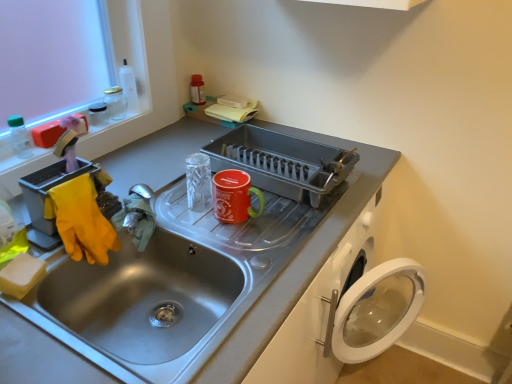
Describe the element at coordinates (19, 137) in the screenshot. I see `transparent plastic bottle at upper left` at that location.

How much space does glossy ceramic mug at upper center, arranged as the 2th appliance when viewed from the left, occupy vertically?

The height of glossy ceramic mug at upper center, arranged as the 2th appliance when viewed from the left, is 4.82 inches.

This screenshot has height=384, width=512. Describe the element at coordinates (282, 162) in the screenshot. I see `metallic gray dish rack at center, which is the first appliance in right-to-left order` at that location.

Find the location of `stainless steel sink at center`. stainless steel sink at center is located at coordinates (194, 288).

Locate an element on the screen. The width and height of the screenshot is (512, 384). transparent plastic bottle at upper left is located at coordinates (19, 137).

From a real-world perspective, is stainless steel sink at center located higher than clear glass jar at upper left, placed as the first appliance when sorted from left to right?

No, from a real-world perspective, stainless steel sink at center is not above clear glass jar at upper left, placed as the first appliance when sorted from left to right.

Which of these two, stainless steel sink at center or clear glass jar at upper left, which is the third appliance from right to left, stands taller?

With more height is stainless steel sink at center.

From the picture: From the image's perspective, is stainless steel sink at center beneath clear glass jar at upper left, which is the third appliance from right to left?

Correct, stainless steel sink at center appears lower than clear glass jar at upper left, which is the third appliance from right to left, in the image.

In the scene shown: Considering the relative positions of stainless steel sink at center and clear glass jar at upper left, placed as the first appliance when sorted from left to right, in the image provided, is stainless steel sink at center to the left of clear glass jar at upper left, placed as the first appliance when sorted from left to right, from the viewer's perspective?

No.

In the scene shown: Are metallic gray dish rack at center, which is the first appliance in right-to-left order, and transparent plastic bottle at upper left located far from each other?

Actually, metallic gray dish rack at center, which is the first appliance in right-to-left order, and transparent plastic bottle at upper left are a little close together.

Based on the photo, does metallic gray dish rack at center, which is the first appliance in right-to-left order, appear on the right side of transparent plastic bottle at upper left?

Yes, metallic gray dish rack at center, which is the first appliance in right-to-left order, is to the right of transparent plastic bottle at upper left.

From a real-world perspective, is metallic gray dish rack at center, the third appliance from the left, beneath transparent plastic bottle at upper left?

Yes, from a real-world perspective, metallic gray dish rack at center, the third appliance from the left, is below transparent plastic bottle at upper left.

Looking at this image, how far apart are metallic gray dish rack at center, which is the first appliance in right-to-left order, and transparent plastic bottle at upper left?

A distance of 29.68 inches exists between metallic gray dish rack at center, which is the first appliance in right-to-left order, and transparent plastic bottle at upper left.

Is metallic gray dish rack at center, the third appliance from the left, closer to the viewer compared to glossy ceramic mug at upper center, arranged as the 2th appliance when viewed from the left?

No, metallic gray dish rack at center, the third appliance from the left, is behind glossy ceramic mug at upper center, arranged as the 2th appliance when viewed from the left.

How distant is metallic gray dish rack at center, which is the first appliance in right-to-left order, from glossy ceramic mug at upper center, the second appliance in the right-to-left sequence?

metallic gray dish rack at center, which is the first appliance in right-to-left order, and glossy ceramic mug at upper center, the second appliance in the right-to-left sequence, are 21.50 centimeters apart from each other.

Is metallic gray dish rack at center, which is the first appliance in right-to-left order, thinner than glossy ceramic mug at upper center, the second appliance in the right-to-left sequence?

In fact, metallic gray dish rack at center, which is the first appliance in right-to-left order, might be wider than glossy ceramic mug at upper center, the second appliance in the right-to-left sequence.

Are metallic gray dish rack at center, which is the first appliance in right-to-left order, and glossy ceramic mug at upper center, arranged as the 2th appliance when viewed from the left, far apart?

That's not correct — metallic gray dish rack at center, which is the first appliance in right-to-left order, is a little close to glossy ceramic mug at upper center, arranged as the 2th appliance when viewed from the left.

Is glossy ceramic mug at upper center, arranged as the 2th appliance when viewed from the left, bigger or smaller than transparent plastic bottle at upper left?

Clearly, glossy ceramic mug at upper center, arranged as the 2th appliance when viewed from the left, is larger in size than transparent plastic bottle at upper left.

Is glossy ceramic mug at upper center, the second appliance in the right-to-left sequence, taller than transparent plastic bottle at upper left?

Incorrect, the height of glossy ceramic mug at upper center, the second appliance in the right-to-left sequence, is not larger of that of transparent plastic bottle at upper left.

Considering the positions of objects glossy ceramic mug at upper center, the second appliance in the right-to-left sequence, and transparent plastic bottle at upper left in the image provided, who is more to the left, glossy ceramic mug at upper center, the second appliance in the right-to-left sequence, or transparent plastic bottle at upper left?

From the viewer's perspective, transparent plastic bottle at upper left appears more on the left side.

From a real-world perspective, is glossy ceramic mug at upper center, the second appliance in the right-to-left sequence, over transparent plastic bottle at upper left?

No, from a real-world perspective, glossy ceramic mug at upper center, the second appliance in the right-to-left sequence, is not on top of transparent plastic bottle at upper left.

What's the angular difference between clear glass jar at upper left, placed as the first appliance when sorted from left to right, and metallic gray dish rack at center, which is the first appliance in right-to-left order,'s facing directions?

They differ by 3.95 degrees in their facing directions.

Is point (93, 112) positioned in front of point (310, 151)?

No, (93, 112) is behind (310, 151).

Consider the image. How distant is clear glass jar at upper left, placed as the first appliance when sorted from left to right, from metallic gray dish rack at center, which is the first appliance in right-to-left order?

A distance of 25.23 inches exists between clear glass jar at upper left, placed as the first appliance when sorted from left to right, and metallic gray dish rack at center, which is the first appliance in right-to-left order.

Considering the relative sizes of clear glass jar at upper left, which is the third appliance from right to left, and metallic gray dish rack at center, the third appliance from the left, in the image provided, is clear glass jar at upper left, which is the third appliance from right to left, taller than metallic gray dish rack at center, the third appliance from the left,?

No, clear glass jar at upper left, which is the third appliance from right to left, is not taller than metallic gray dish rack at center, the third appliance from the left.

Which of these two, clear glass jar at upper left, placed as the first appliance when sorted from left to right, or glossy ceramic mug at upper center, the second appliance in the right-to-left sequence, is bigger?

glossy ceramic mug at upper center, the second appliance in the right-to-left sequence.

From the image's perspective, is clear glass jar at upper left, which is the third appliance from right to left, positioned above or below glossy ceramic mug at upper center, arranged as the 2th appliance when viewed from the left?

clear glass jar at upper left, which is the third appliance from right to left, is situated higher than glossy ceramic mug at upper center, arranged as the 2th appliance when viewed from the left, in the image.

Could you tell me if clear glass jar at upper left, which is the third appliance from right to left, is turned towards glossy ceramic mug at upper center, the second appliance in the right-to-left sequence?

Yes, clear glass jar at upper left, which is the third appliance from right to left, faces towards glossy ceramic mug at upper center, the second appliance in the right-to-left sequence.

From a real-world perspective, count 2nd appliances upward from the glossy ceramic mug at upper center, the second appliance in the right-to-left sequence, and point to it. Please provide its 2D coordinates.

[(98, 114)]

How far apart are transparent plastic bottle at upper left and glossy ceramic mug at upper center, the second appliance in the right-to-left sequence?

transparent plastic bottle at upper left and glossy ceramic mug at upper center, the second appliance in the right-to-left sequence, are 25.54 inches apart.

How many degrees apart are the facing directions of transparent plastic bottle at upper left and glossy ceramic mug at upper center, the second appliance in the right-to-left sequence?

transparent plastic bottle at upper left and glossy ceramic mug at upper center, the second appliance in the right-to-left sequence, are facing 1.63 degrees away from each other.

Does transparent plastic bottle at upper left come in front of glossy ceramic mug at upper center, the second appliance in the right-to-left sequence?

No, transparent plastic bottle at upper left is behind glossy ceramic mug at upper center, the second appliance in the right-to-left sequence.

Does transparent plastic bottle at upper left have a greater width compared to glossy ceramic mug at upper center, the second appliance in the right-to-left sequence?

No, transparent plastic bottle at upper left is not wider than glossy ceramic mug at upper center, the second appliance in the right-to-left sequence.

Locate an element on the screen. the 3rd appliance above the stainless steel sink at center (from a real-world perspective) is located at coordinates (98, 114).

Where is `bottle on the left of metallic gray dish rack at center, which is the first appliance in right-to-left order`? bottle on the left of metallic gray dish rack at center, which is the first appliance in right-to-left order is located at coordinates (19, 137).

From the picture: Based on their spatial positions, is stainless steel sink at center or clear glass jar at upper left, which is the third appliance from right to left, closer to glossy ceramic mug at upper center, arranged as the 2th appliance when viewed from the left?

Among the two, stainless steel sink at center is located nearer to glossy ceramic mug at upper center, arranged as the 2th appliance when viewed from the left.

Estimate the real-world distances between objects in this image. Which object is further from stainless steel sink at center, glossy ceramic mug at upper center, arranged as the 2th appliance when viewed from the left, or metallic gray dish rack at center, the third appliance from the left?

Based on the image, glossy ceramic mug at upper center, arranged as the 2th appliance when viewed from the left, appears to be further to stainless steel sink at center.

Considering their positions, is stainless steel sink at center positioned closer to metallic gray dish rack at center, which is the first appliance in right-to-left order, than transparent plastic bottle at upper left?

The object closer to metallic gray dish rack at center, which is the first appliance in right-to-left order, is stainless steel sink at center.

Which object lies further to the anchor point transparent plastic bottle at upper left, glossy ceramic mug at upper center, arranged as the 2th appliance when viewed from the left, or metallic gray dish rack at center, the third appliance from the left?

Based on the image, metallic gray dish rack at center, the third appliance from the left, appears to be further to transparent plastic bottle at upper left.

From the image, which object appears to be nearer to stainless steel sink at center, clear glass jar at upper left, which is the third appliance from right to left, or glossy ceramic mug at upper center, arranged as the 2th appliance when viewed from the left?

Among the two, glossy ceramic mug at upper center, arranged as the 2th appliance when viewed from the left, is located nearer to stainless steel sink at center.

From the image, which object appears to be nearer to transparent plastic bottle at upper left, clear glass jar at upper left, which is the third appliance from right to left, or glossy ceramic mug at upper center, arranged as the 2th appliance when viewed from the left?

The object closer to transparent plastic bottle at upper left is clear glass jar at upper left, which is the third appliance from right to left.

Which object lies further to the anchor point metallic gray dish rack at center, the third appliance from the left, glossy ceramic mug at upper center, the second appliance in the right-to-left sequence, or clear glass jar at upper left, which is the third appliance from right to left?

clear glass jar at upper left, which is the third appliance from right to left.

Estimate the real-world distances between objects in this image. Which object is further from transparent plastic bottle at upper left, stainless steel sink at center or metallic gray dish rack at center, which is the first appliance in right-to-left order?

metallic gray dish rack at center, which is the first appliance in right-to-left order, lies further to transparent plastic bottle at upper left than the other object.

Find the location of a particular element. Image resolution: width=512 pixels, height=384 pixels. sink between transparent plastic bottle at upper left and metallic gray dish rack at center, which is the first appliance in right-to-left order is located at coordinates (194, 288).

Locate an element on the screen. The image size is (512, 384). appliance between stainless steel sink at center and metallic gray dish rack at center, which is the first appliance in right-to-left order, from front to back is located at coordinates (234, 196).

Find the location of `appliance situated between transparent plastic bottle at upper left and glossy ceramic mug at upper center, the second appliance in the right-to-left sequence, from left to right`. appliance situated between transparent plastic bottle at upper left and glossy ceramic mug at upper center, the second appliance in the right-to-left sequence, from left to right is located at coordinates (98, 114).

The width and height of the screenshot is (512, 384). I want to click on sink between transparent plastic bottle at upper left and glossy ceramic mug at upper center, the second appliance in the right-to-left sequence, in the horizontal direction, so click(194, 288).